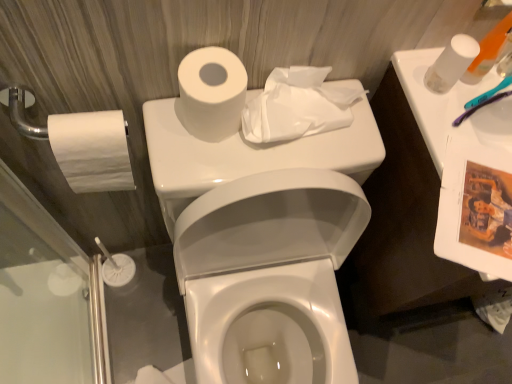
Locate an element on the screen. The image size is (512, 384). vacant space in front of translucent plastic toothbrush at upper right, the second toiletry in the left-to-right sequence is located at coordinates (468, 152).